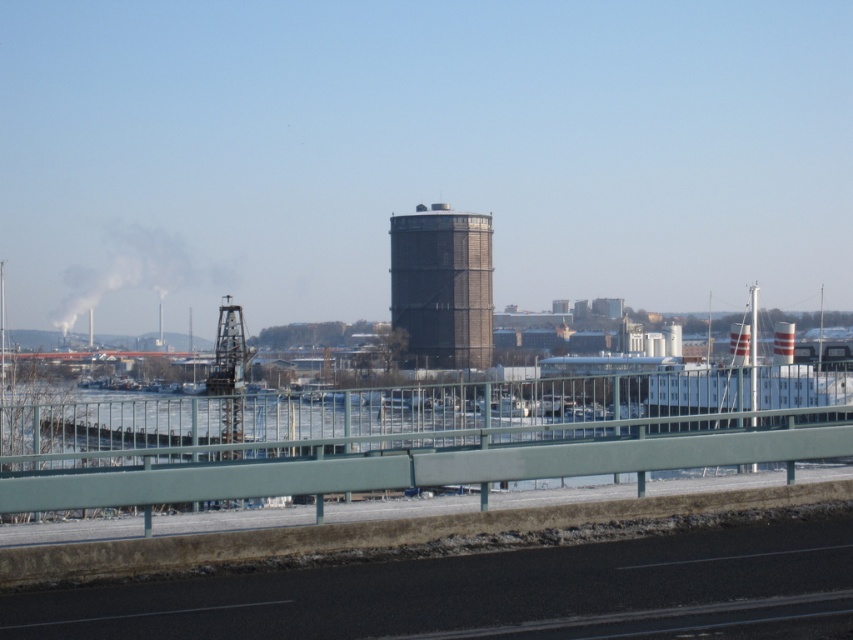
You are a delivery drone flying above the winter scene. You need to navigate between the green metal railing at lower center and the smoketransparent at left. Which object should you fly under to ensure you can pass safely?

You should fly under the smoketransparent at left because the green metal railing at lower center has a lesser height compared to smoketransparent at left, so the smoketransparent at left allows for more clearance.

You are a drone operator trying to capture aerial footage of the black asphalt highway at lower center and the smoketransparent at left. Which object should you focus on first if you want to film the taller one first?

The smoketransparent at left is taller than the black asphalt highway at lower center, so you should focus on the smoketransparent at left first.

You are standing on a bridge and want to place a small potted plant on the green metal railing at lower center. The plant requires a space of 0.5 meters in length. Can you determine if the railing has enough space for the plant?

The green metal railing at lower center is located at point coordinates, but the description does not provide its length. Therefore, it is impossible to determine if the space is sufficient for the plant.